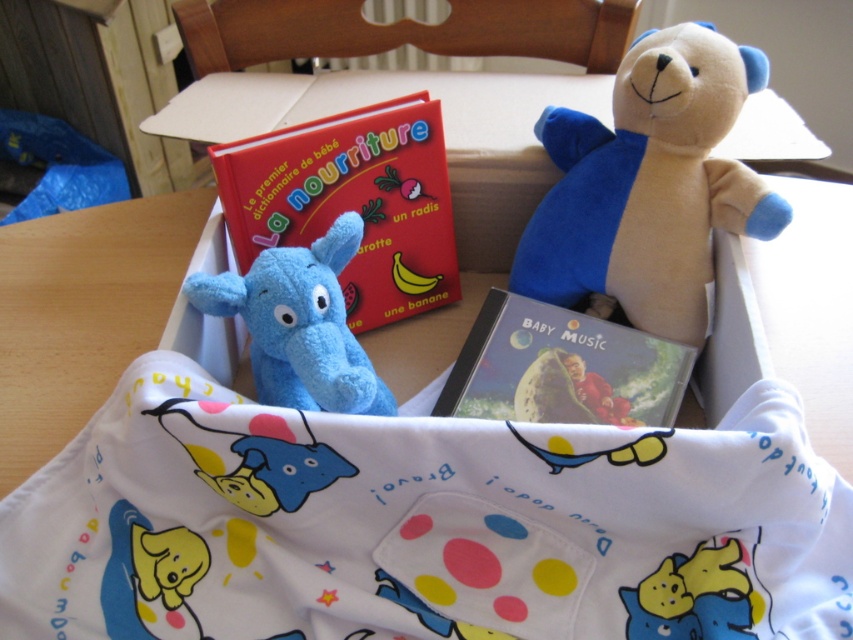
Question: Among these points, which one is farthest from the camera?

Choices:
 (A) (583, 380)
 (B) (570, 257)
 (C) (289, 177)

Answer: (B)

Question: Which of the following is the closest to the observer?

Choices:
 (A) red matte book at center
 (B) soft plush bear at upper right

Answer: (B)

Question: Which of the following is the farthest from the observer?

Choices:
 (A) matte plastic cd at center
 (B) soft plush bear at upper right

Answer: (A)

Question: Does soft plush bear at upper right have a smaller size compared to matte plastic cd at center?

Choices:
 (A) no
 (B) yes

Answer: (A)

Question: Observing the image, what is the correct spatial positioning of soft plush bear at upper right in reference to soft blue plush elephant at center?

Choices:
 (A) right
 (B) left

Answer: (A)

Question: Is soft plush bear at upper right to the left of soft blue plush elephant at center from the viewer's perspective?

Choices:
 (A) no
 (B) yes

Answer: (A)